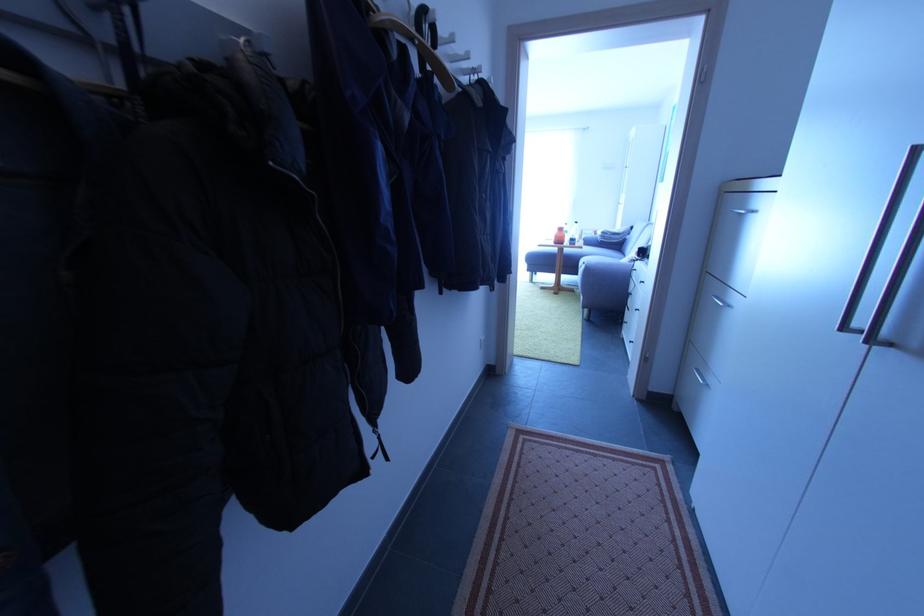
Identify the location of white coat hook. The height and width of the screenshot is (616, 924). (456, 57).